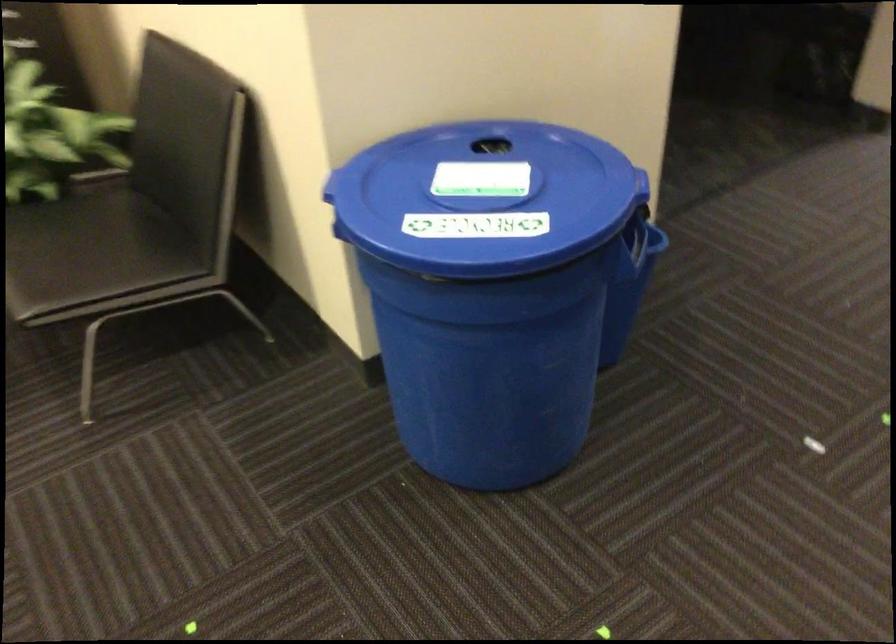
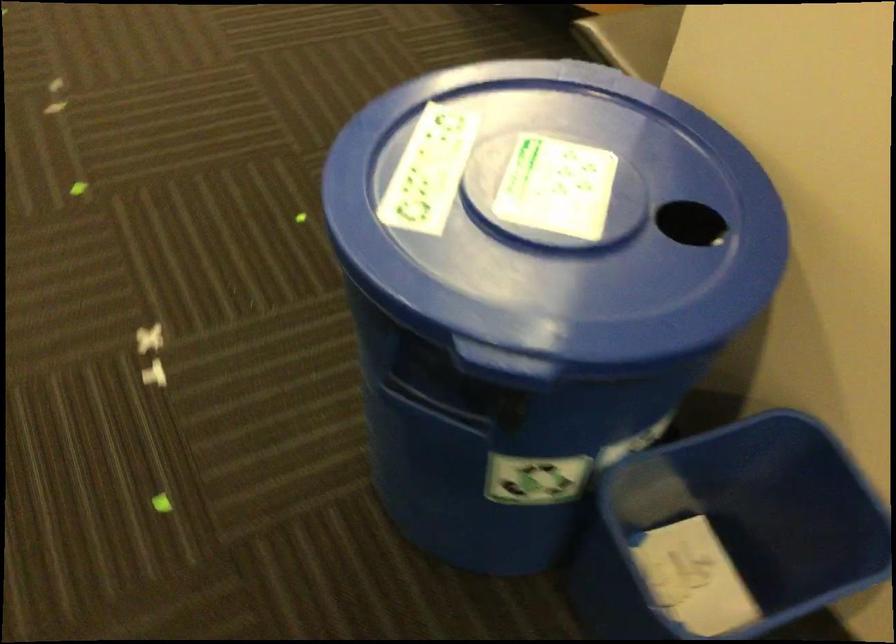
Where in the second image is the point corresponding to point (634, 252) from the first image?

(426, 406)